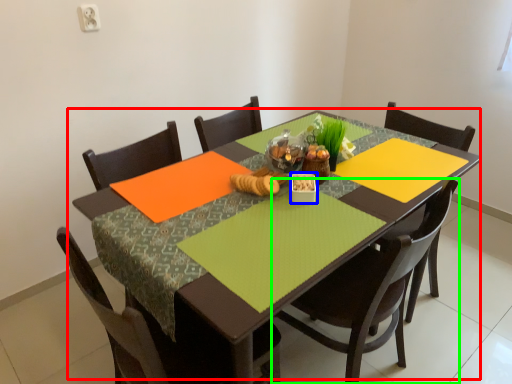
Question: Considering the real-world distances, which object is farthest from table (highlighted by a red box)? tableware (highlighted by a blue box) or chair (highlighted by a green box)?

Choices:
 (A) tableware
 (B) chair

Answer: (A)